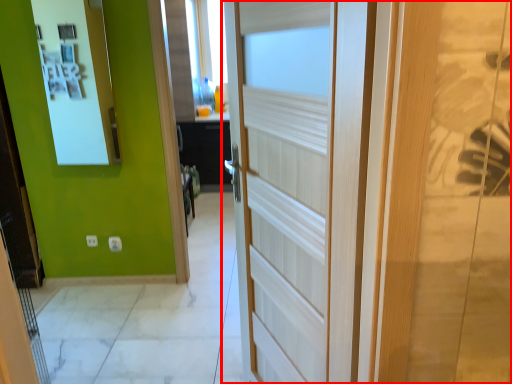
Question: From the image's perspective, considering the relative positions of door (annotated by the red box) and medicine cabinet in the image provided, where is door (annotated by the red box) located with respect to the staircase?

Choices:
 (A) below
 (B) above

Answer: (A)